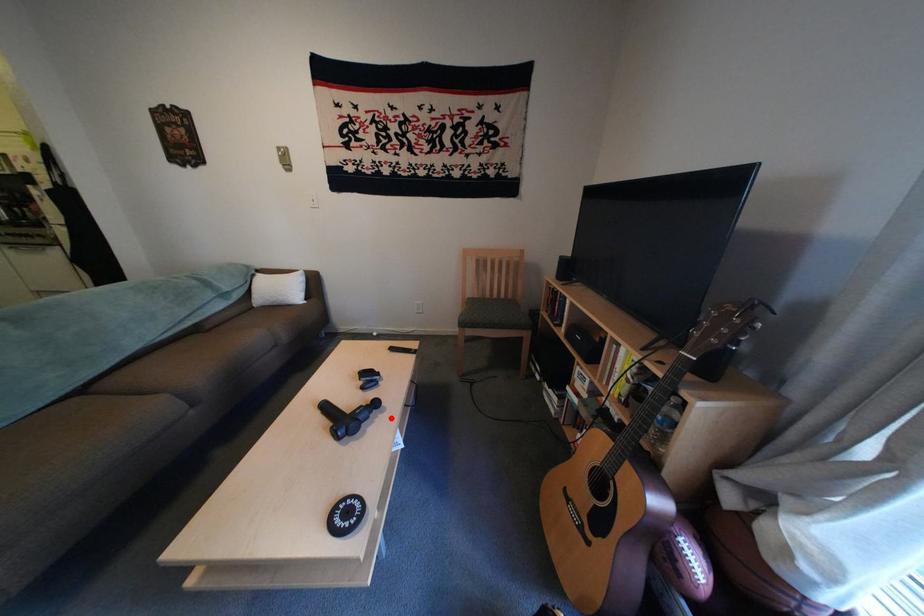
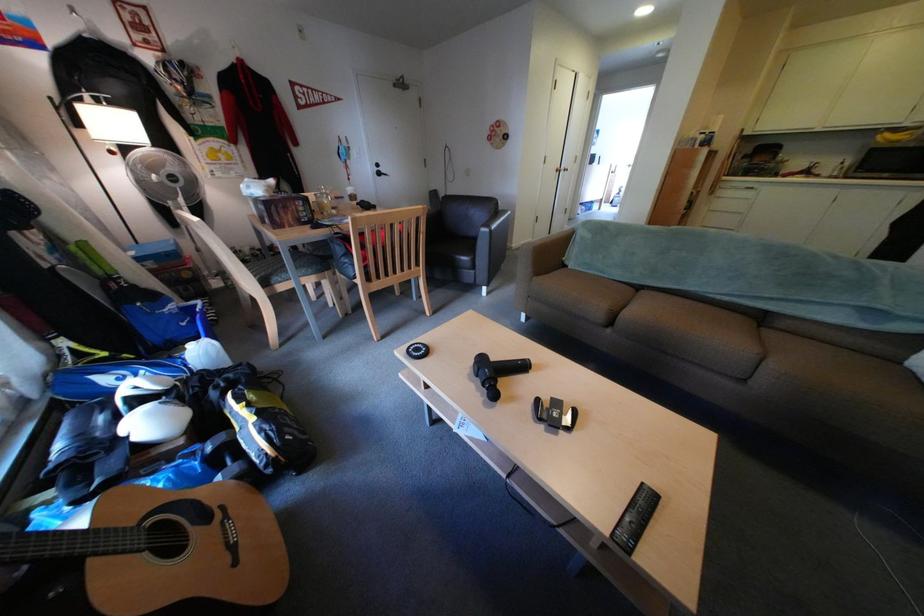
Question: I am providing you with two images of the same scene from different viewpoints. Given a red point in image1, look at the same physical point in image2. Is it:

Choices:
 (A) Closer to the viewpoint
 (B) Farther from the viewpoint

Answer: (B)